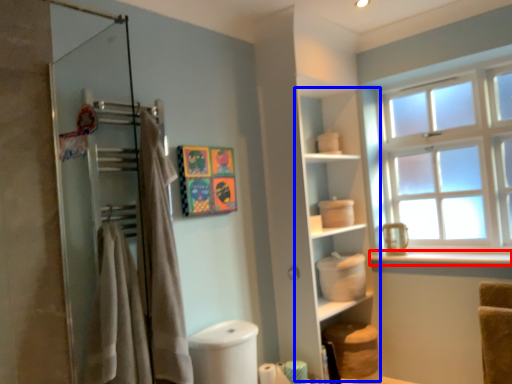
Question: Among these objects, which one is farthest to the camera, window sill (highlighted by a red box) or cabinet (highlighted by a blue box)?

Choices:
 (A) window sill
 (B) cabinet

Answer: (B)